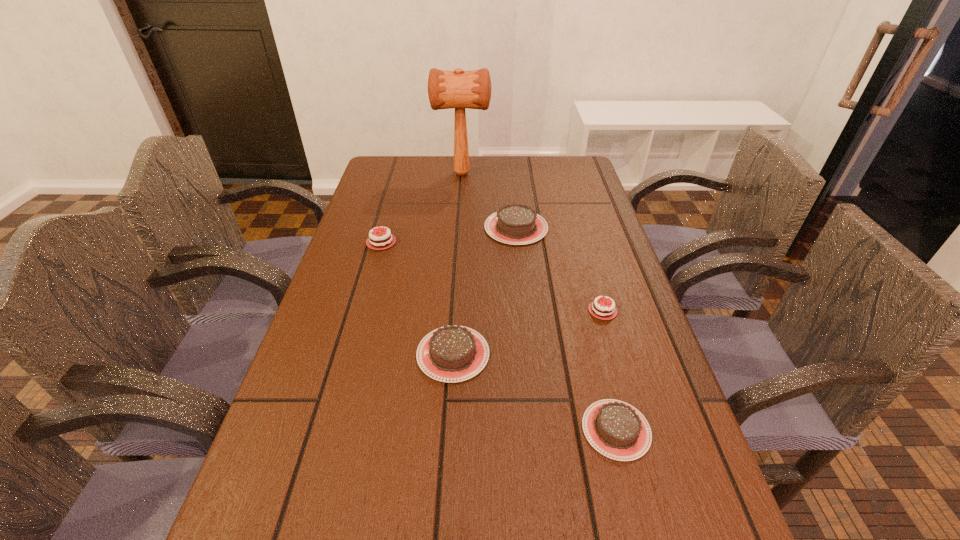
In the image, there is a desktop. Where is `free space at the right edge`? This screenshot has width=960, height=540. free space at the right edge is located at coordinates (596, 387).

Find the location of `blank space at the far right corner of the desktop`. blank space at the far right corner of the desktop is located at coordinates (558, 180).

Where is `free space between the farthest brown chocolate cake and the biggest red chocolate cake`? The height and width of the screenshot is (540, 960). free space between the farthest brown chocolate cake and the biggest red chocolate cake is located at coordinates (448, 235).

Find the location of a particular element. This screenshot has width=960, height=540. empty space that is in between the second biggest brown chocolate cake and the biggest red chocolate cake is located at coordinates (418, 298).

Locate an element on the screen. This screenshot has height=540, width=960. vacant space in between the farthest brown chocolate cake and the mallet is located at coordinates (489, 200).

Locate which object ranks third in proximity to the tallest object. Please provide its 2D coordinates. Your answer should be formatted as a tuple, i.e. [(x, y)], where the tuple contains the x and y coordinates of a point satisfying the conditions above.

[(602, 311)]

Locate an element on the screen. object that stands as the sixth closest to the leftmost red chocolate cake is located at coordinates 455,539.

This screenshot has height=540, width=960. What are the coordinates of `chocolate cake that is the closest to the biggest brown chocolate cake` in the screenshot? It's located at (602, 311).

Choose which chocolate cake is the fourth nearest neighbor to the shortest chocolate cake. Please provide its 2D coordinates. Your answer should be formatted as a tuple, i.e. [(x, y)], where the tuple contains the x and y coordinates of a point satisfying the conditions above.

[(375, 245)]

Locate an element on the screen. Image resolution: width=960 pixels, height=540 pixels. brown chocolate cake that stands as the closest to the tallest object is located at coordinates (515, 224).